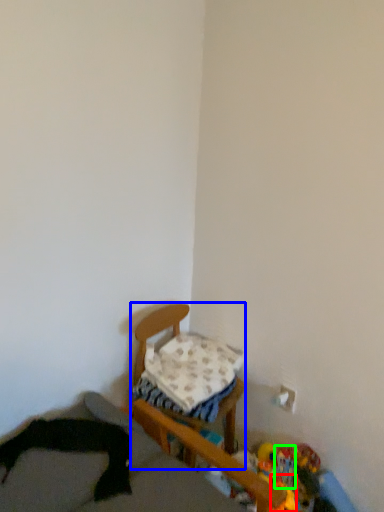
Question: Which object is the farthest from toy (highlighted by a red box)? Choose among these: furniture (highlighted by a blue box) or toy (highlighted by a green box).

Choices:
 (A) furniture
 (B) toy

Answer: (A)